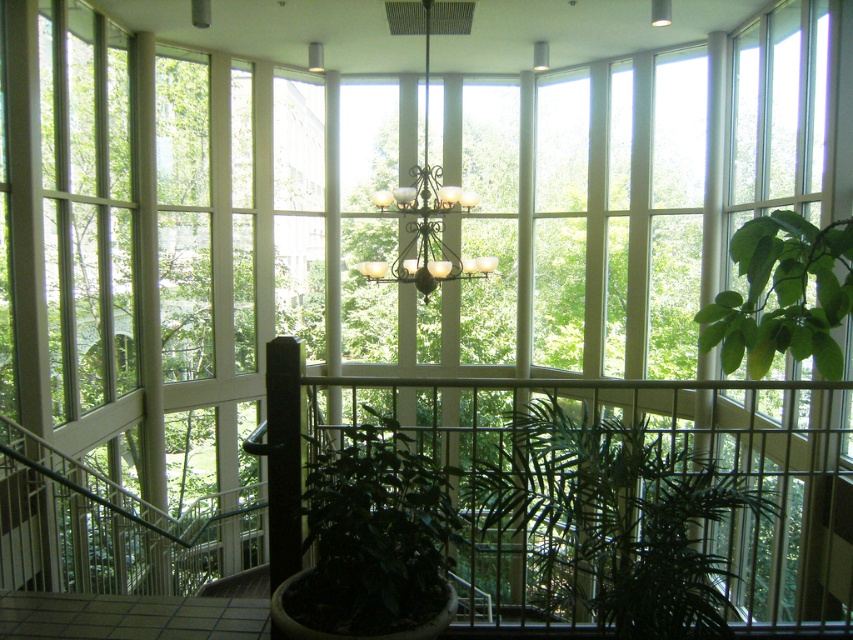
Which of these two, green leafy plant at center or matte glass chandelier at center, stands shorter?

green leafy plant at center

The image size is (853, 640). Describe the element at coordinates (611, 522) in the screenshot. I see `green leafy plant at center` at that location.

Does point (556, 426) lie in front of point (428, 113)?

That is True.

You are a GUI agent. You are given a task and a screenshot of the screen. Output one action in this format:
    pyautogui.click(x=<x>, y=<y>)
    Task: Click on the green leafy plant at center
    
    Given the screenshot: What is the action you would take?
    pyautogui.click(x=611, y=522)

Does green matte plant at center have a smaller size compared to green leafy plant at right?

A: Indeed, green matte plant at center has a smaller size compared to green leafy plant at right.

Is green matte plant at center in front of green leafy plant at right?

Yes, green matte plant at center is in front of green leafy plant at right.

Does point (376, 600) come farther from viewer compared to point (833, 340)?

No, (376, 600) is closer to viewer.

At what (x,y) coordinates should I click in order to perform the action: click on green matte plant at center. Please return your answer as a coordinate pair (x, y). Looking at the image, I should click on (373, 536).

Is the position of green leafy plant at center less distant than that of green leafy plant at right?

Yes, green leafy plant at center is in front of green leafy plant at right.

Can you confirm if green leafy plant at center is thinner than green leafy plant at right?

Yes, green leafy plant at center is thinner than green leafy plant at right.

Locate an element on the screen. Image resolution: width=853 pixels, height=640 pixels. green leafy plant at center is located at coordinates (611, 522).